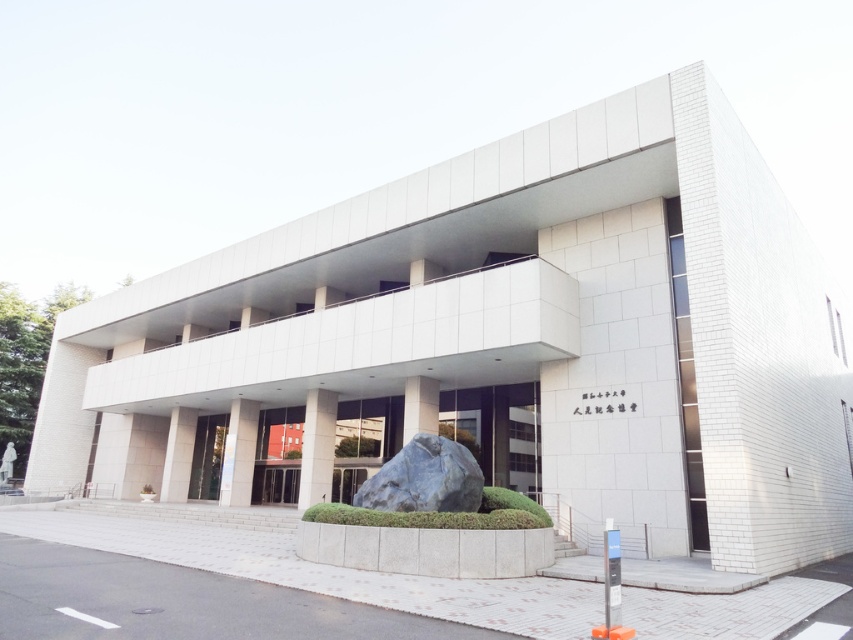
In the scene shown: You are a delivery person trying to enter the building. You need to find the entrance. Which door should you approach? The smooth glass door at center or the white glass door at center?

The smooth glass door at center has a larger size compared to the white glass door at center, so you should approach the smooth glass door at center as it is more likely to be the entrance.